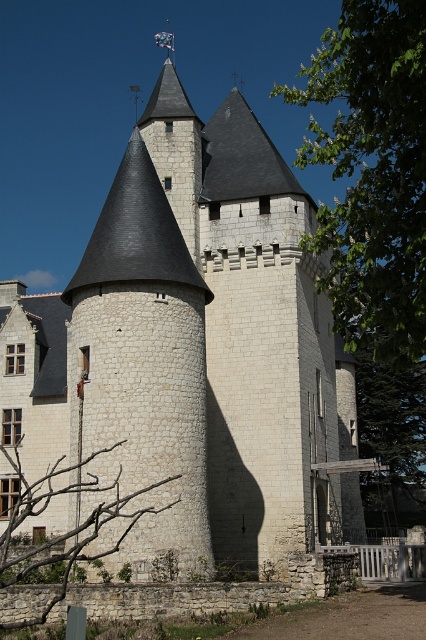
Is green leafy tree at upper right bigger than bare branches at lower left?

Correct, green leafy tree at upper right is larger in size than bare branches at lower left.

Is the position of green leafy tree at upper right less distant than that of bare branches at lower left?

No, it is not.

You are a GUI agent. You are given a task and a screenshot of the screen. Output one action in this format:
    pyautogui.click(x=<x>, y=<y>)
    Task: Click on the green leafy tree at upper right
    This screenshot has width=426, height=640.
    Given the screenshot: What is the action you would take?
    pyautogui.click(x=371, y=173)